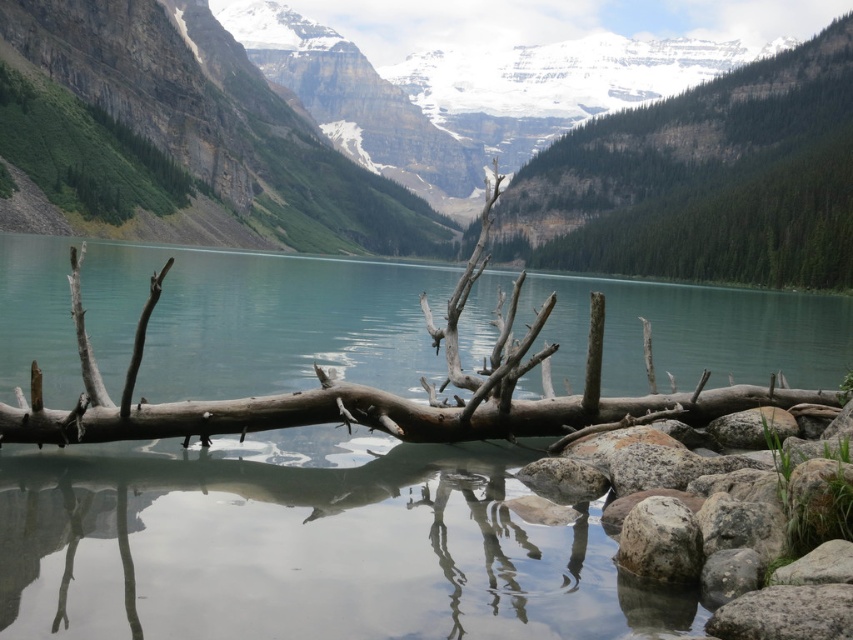
Is point (148, 257) farther from viewer compared to point (711, 195)?

No, it is in front of (711, 195).

From the picture: Is clear water at center shorter than green textured tree at upper center?

Indeed, clear water at center has a lesser height compared to green textured tree at upper center.

Is point (732, 332) farther from viewer compared to point (735, 168)?

No, (732, 332) is closer to viewer.

The image size is (853, 640). What are the coordinates of `clear water at center` in the screenshot? It's located at (302, 545).

Can you confirm if clear water at center is shorter than gray rough rock at lower center?

No, clear water at center is not shorter than gray rough rock at lower center.

Does clear water at center appear under gray rough rock at lower center?

No, clear water at center is not below gray rough rock at lower center.

Is point (103, 467) farther from viewer compared to point (671, 529)?

That is True.

At what (x,y) coordinates should I click in order to perform the action: click on clear water at center. Please return your answer as a coordinate pair (x, y). Image resolution: width=853 pixels, height=640 pixels. Looking at the image, I should click on (302, 545).

Which is behind, point (672, 243) or point (671, 506)?

Point (672, 243)

Is green textured tree at upper center to the left of gray rough rock at lower center from the viewer's perspective?

No, green textured tree at upper center is not to the left of gray rough rock at lower center.

Is point (763, 97) behind point (653, 579)?

Yes.

Image resolution: width=853 pixels, height=640 pixels. I want to click on green textured tree at upper center, so click(x=703, y=180).